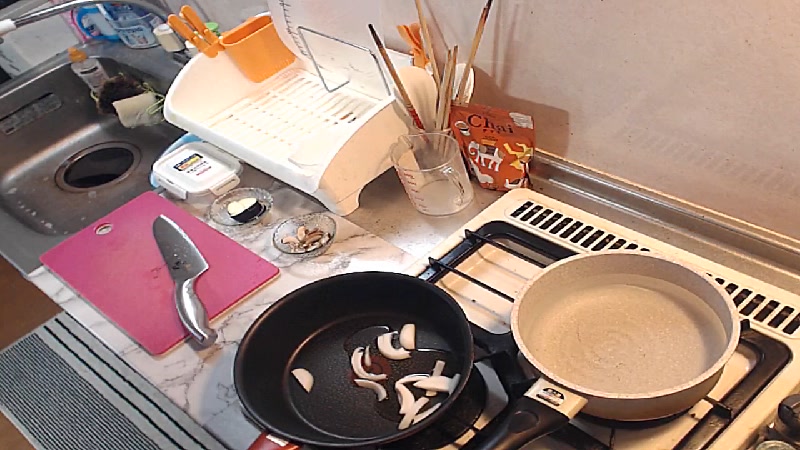
Image resolution: width=800 pixels, height=450 pixels. In order to click on black pan in this screenshot , I will do `click(338, 422)`.